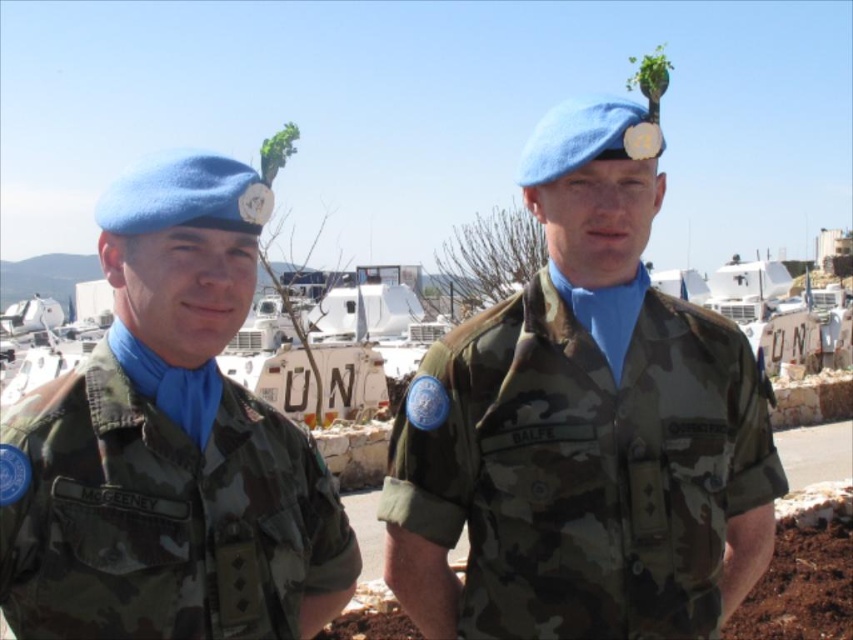
Between camo uniform at center and camo fabric uniform at left, which one is positioned higher?

camo uniform at center

I want to click on camo uniform at center, so click(x=583, y=428).